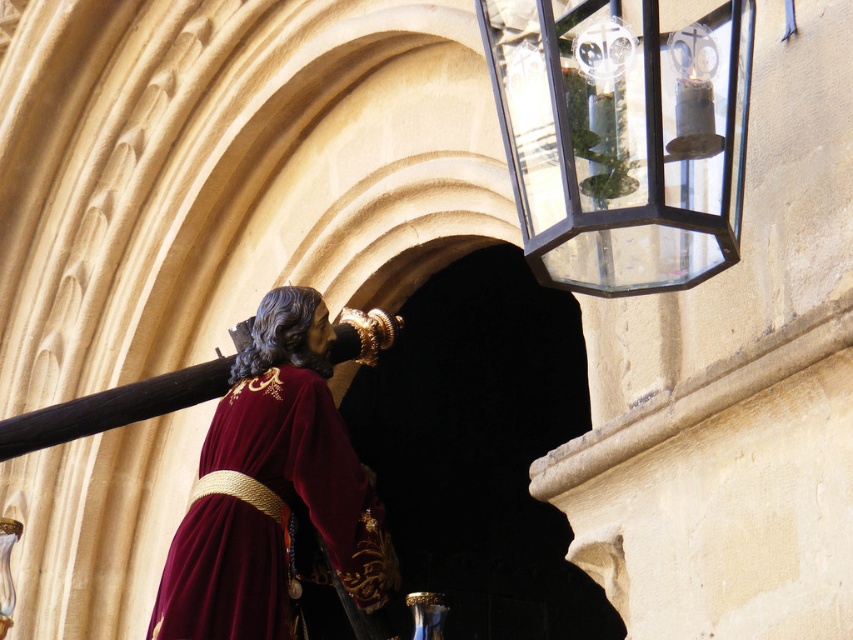
What do you see at coordinates (622, 138) in the screenshot? I see `clear glass lantern at upper right` at bounding box center [622, 138].

Between point (740, 29) and point (276, 579), which one is positioned in front?

Point (740, 29) is more forward.

Between point (492, 44) and point (225, 451), which one is positioned behind?

Positioned behind is point (225, 451).

Locate an element on the screen. The height and width of the screenshot is (640, 853). clear glass lantern at upper right is located at coordinates (622, 138).